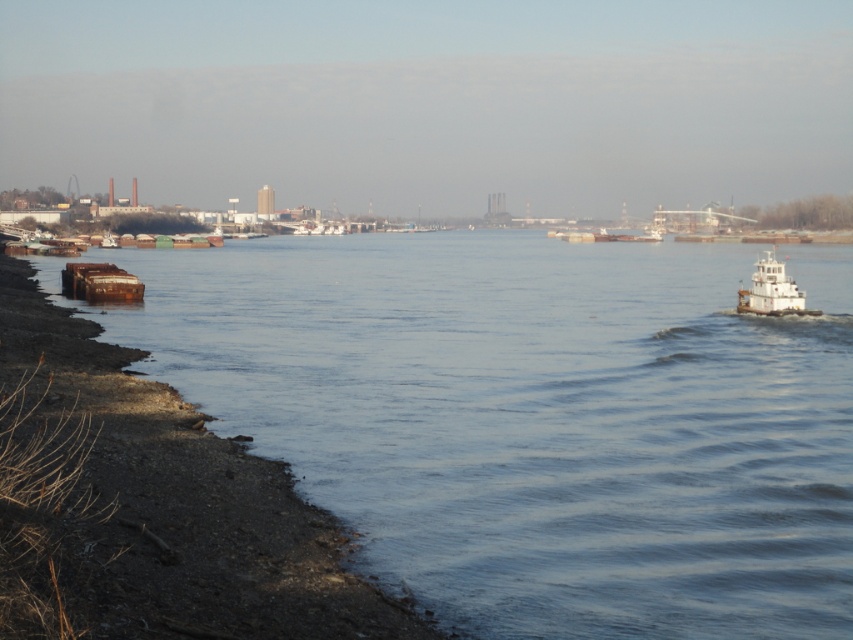
Question: Is blue water at lower left to the right of rusty metal barge at left from the viewer's perspective?

Choices:
 (A) no
 (B) yes

Answer: (B)

Question: Which point is farther to the camera?

Choices:
 (A) white matte tugboat at right
 (B) rusty metal barge at lower left
 (C) rusty metal barge at left

Answer: (B)

Question: Which point is closer to the camera?

Choices:
 (A) (776, 275)
 (B) (91, 394)
 (C) (265, 362)

Answer: (B)

Question: Estimate the real-world distances between objects in this image. Which object is farther from the rusty metal barge at left?

Choices:
 (A) white matte tugboat at right
 (B) rusty metal barge at lower left
 (C) blue water at lower left

Answer: (C)

Question: Does blue water at lower left appear on the right side of white matte tugboat at right?

Choices:
 (A) yes
 (B) no

Answer: (B)

Question: Considering the relative positions of blue water at lower left and white matte tugboat at right in the image provided, where is blue water at lower left located with respect to white matte tugboat at right?

Choices:
 (A) below
 (B) above

Answer: (B)